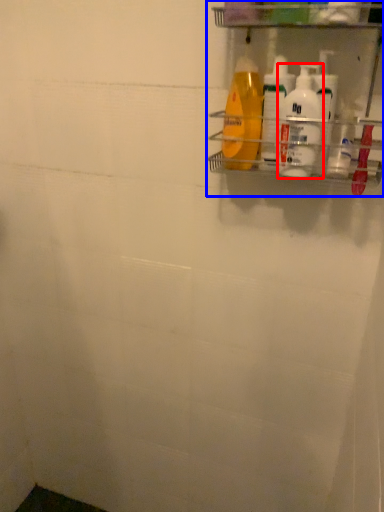
Question: Which point is closer to the camera, cleaning product (highlighted by a red box) or shelf (highlighted by a blue box)?

Choices:
 (A) cleaning product
 (B) shelf

Answer: (B)